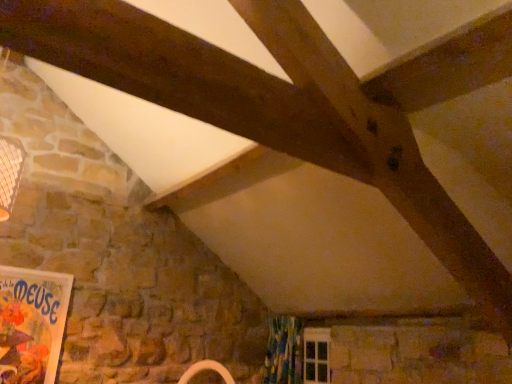
Question: Should I look upward or downward to see matte paper poster at lower left?

Choices:
 (A) down
 (B) up

Answer: (A)

Question: Is textured floral curtain at lower center oriented away from matte paper poster at lower left?

Choices:
 (A) no
 (B) yes

Answer: (A)

Question: Does textured floral curtain at lower center turn towards matte paper poster at lower left?

Choices:
 (A) no
 (B) yes

Answer: (B)

Question: Is textured floral curtain at lower center not within matte paper poster at lower left?

Choices:
 (A) no
 (B) yes

Answer: (B)

Question: From a real-world perspective, is textured floral curtain at lower center positioned over matte paper poster at lower left based on gravity?

Choices:
 (A) yes
 (B) no

Answer: (B)

Question: Is textured floral curtain at lower center bigger than matte paper poster at lower left?

Choices:
 (A) no
 (B) yes

Answer: (B)

Question: From the image's perspective, is textured floral curtain at lower center beneath matte paper poster at lower left?

Choices:
 (A) yes
 (B) no

Answer: (A)

Question: Considering the relative sizes of matte paper poster at lower left and textured floral curtain at lower center in the image provided, is matte paper poster at lower left shorter than textured floral curtain at lower center?

Choices:
 (A) no
 (B) yes

Answer: (A)

Question: Does matte paper poster at lower left appear on the left side of textured floral curtain at lower center?

Choices:
 (A) yes
 (B) no

Answer: (A)

Question: Does matte paper poster at lower left lie in front of textured floral curtain at lower center?

Choices:
 (A) no
 (B) yes

Answer: (B)

Question: From the image's perspective, does matte paper poster at lower left appear lower than textured floral curtain at lower center?

Choices:
 (A) yes
 (B) no

Answer: (B)

Question: Is matte paper poster at lower left aimed at textured floral curtain at lower center?

Choices:
 (A) yes
 (B) no

Answer: (B)

Question: Considering the relative sizes of matte paper poster at lower left and textured floral curtain at lower center in the image provided, is matte paper poster at lower left smaller than textured floral curtain at lower center?

Choices:
 (A) yes
 (B) no

Answer: (A)

Question: From a real-world perspective, is matte paper poster at lower left physically located above or below textured floral curtain at lower center?

Choices:
 (A) below
 (B) above

Answer: (B)